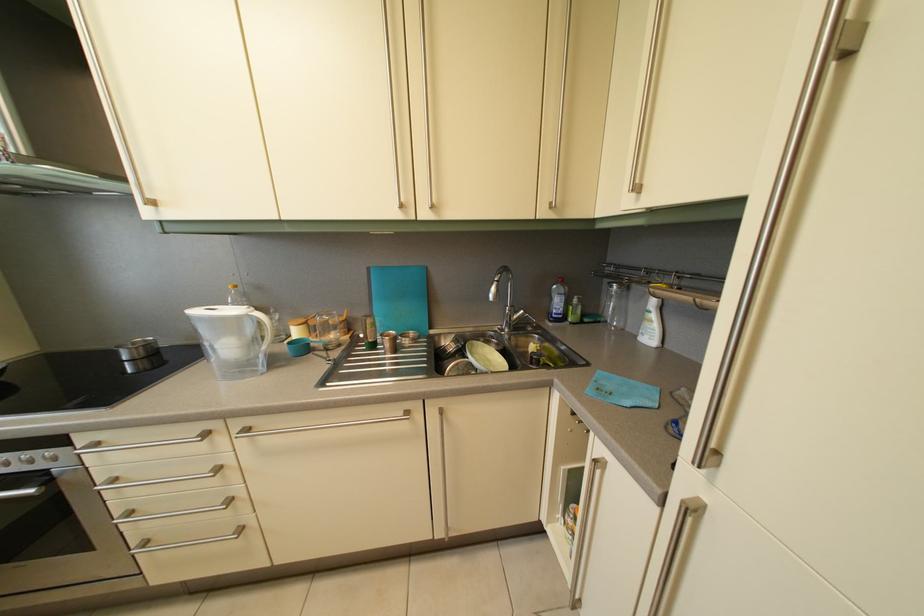
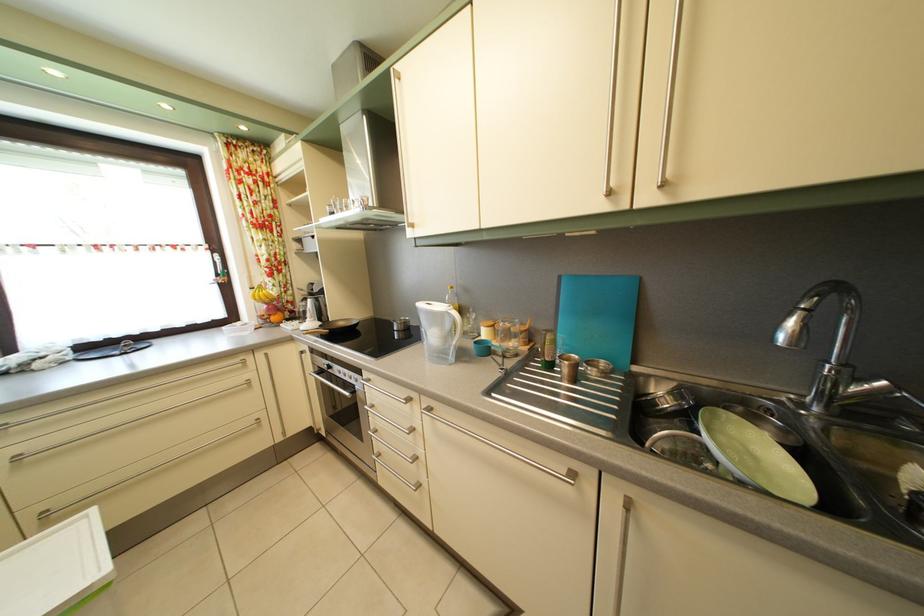
Locate, in the second image, the point that corresponds to pixel 530 318 in the first image.

(893, 391)